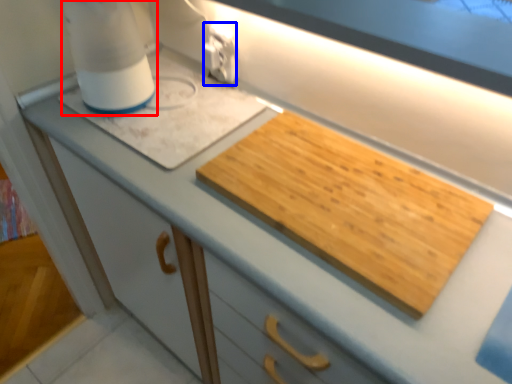
Question: Which object is closer to the camera taking this photo, blender (highlighted by a red box) or electric outlet (highlighted by a blue box)?

Choices:
 (A) blender
 (B) electric outlet

Answer: (A)